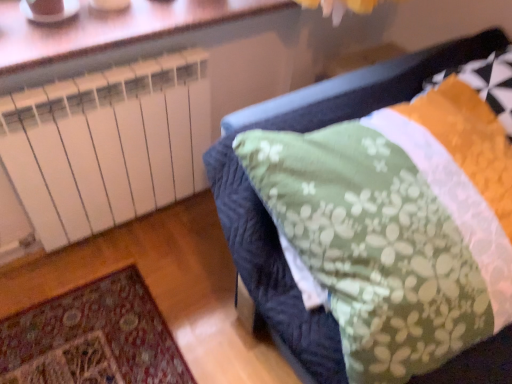
Question: Is orange textured pillow at upper right smaller than green floral fabric at center?

Choices:
 (A) no
 (B) yes

Answer: (B)

Question: Is orange textured pillow at upper right turned away from green floral fabric at center?

Choices:
 (A) no
 (B) yes

Answer: (B)

Question: Does orange textured pillow at upper right come behind green floral fabric at center?

Choices:
 (A) yes
 (B) no

Answer: (A)

Question: From the image's perspective, is orange textured pillow at upper right over green floral fabric at center?

Choices:
 (A) yes
 (B) no

Answer: (A)

Question: Does orange textured pillow at upper right have a lesser height compared to green floral fabric at center?

Choices:
 (A) yes
 (B) no

Answer: (A)

Question: Is there a large distance between orange textured pillow at upper right and green floral fabric at center?

Choices:
 (A) yes
 (B) no

Answer: (B)

Question: Could you tell me if green floral fabric at center is facing orange textured pillow at upper right?

Choices:
 (A) no
 (B) yes

Answer: (B)

Question: Does green floral fabric at center come in front of orange textured pillow at upper right?

Choices:
 (A) yes
 (B) no

Answer: (A)

Question: Can you confirm if green floral fabric at center is thinner than orange textured pillow at upper right?

Choices:
 (A) no
 (B) yes

Answer: (A)

Question: From a real-world perspective, is green floral fabric at center under orange textured pillow at upper right?

Choices:
 (A) yes
 (B) no

Answer: (A)

Question: From the image's perspective, is green floral fabric at center over orange textured pillow at upper right?

Choices:
 (A) no
 (B) yes

Answer: (A)

Question: Considering the relative sizes of green floral fabric at center and orange textured pillow at upper right in the image provided, is green floral fabric at center wider than orange textured pillow at upper right?

Choices:
 (A) no
 (B) yes

Answer: (B)

Question: Is orange textured pillow at upper right thinner than white plastic radiator at upper left?

Choices:
 (A) no
 (B) yes

Answer: (B)